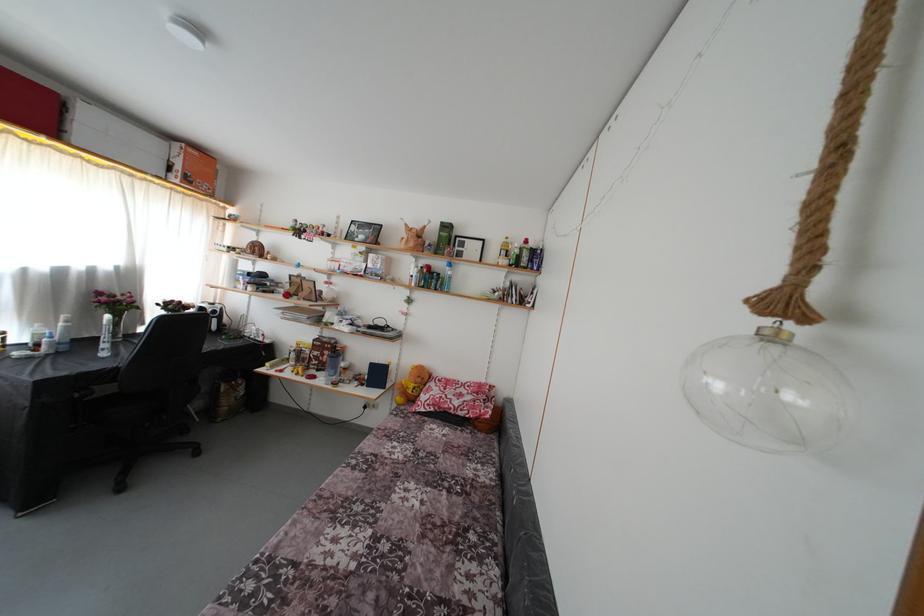
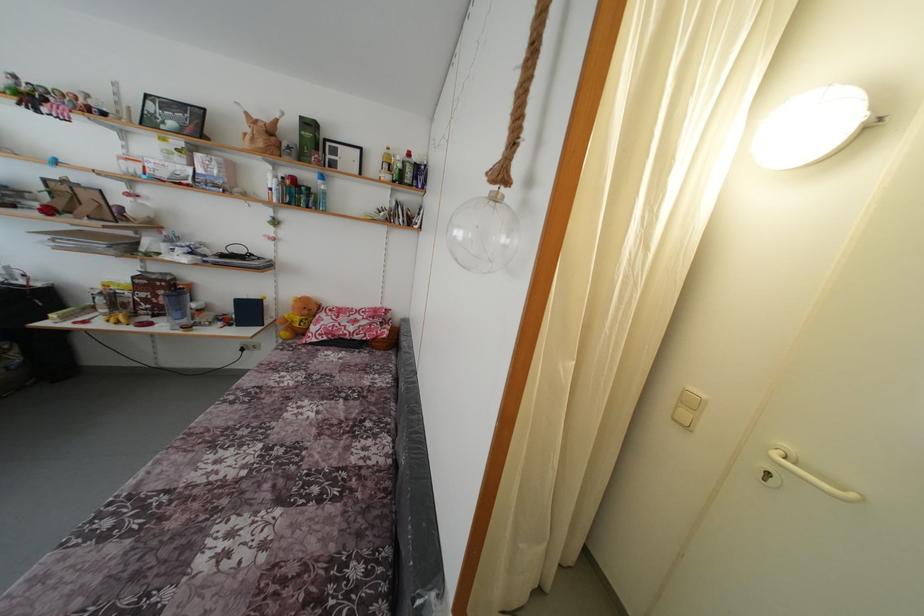
Find the pixel in the second image that matches pixel 453 274 in the first image.

(324, 188)